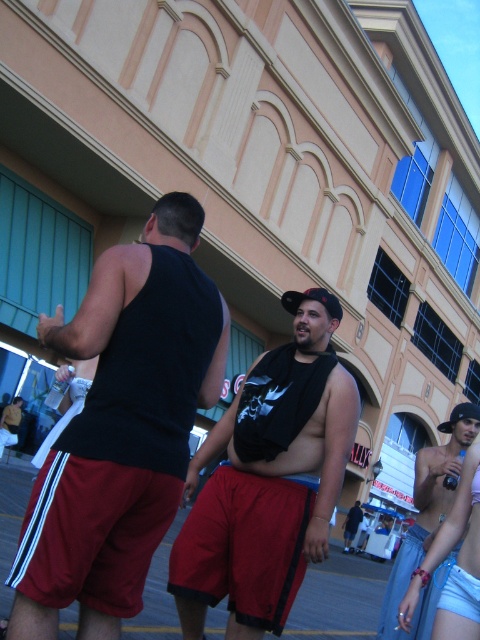
Question: Which point is farther to the camera?

Choices:
 (A) nude skin at lower right
 (B) black matte tank top at center
 (C) black matte vest at center
 (D) matte black tank top at center

Answer: (D)

Question: Considering the relative positions of black matte vest at center and matte black tank top at center in the image provided, where is black matte vest at center located with respect to matte black tank top at center?

Choices:
 (A) right
 (B) left

Answer: (B)

Question: Does black matte vest at center appear on the right side of nude skin at lower right?

Choices:
 (A) yes
 (B) no

Answer: (B)

Question: Among these objects, which one is farthest from the camera?

Choices:
 (A) matte black tank top at center
 (B) black matte vest at center

Answer: (A)

Question: Which point is closer to the camera taking this photo?

Choices:
 (A) (299, 506)
 (B) (475, 464)

Answer: (B)

Question: Is black matte tank top at center above black matte vest at center?

Choices:
 (A) yes
 (B) no

Answer: (A)